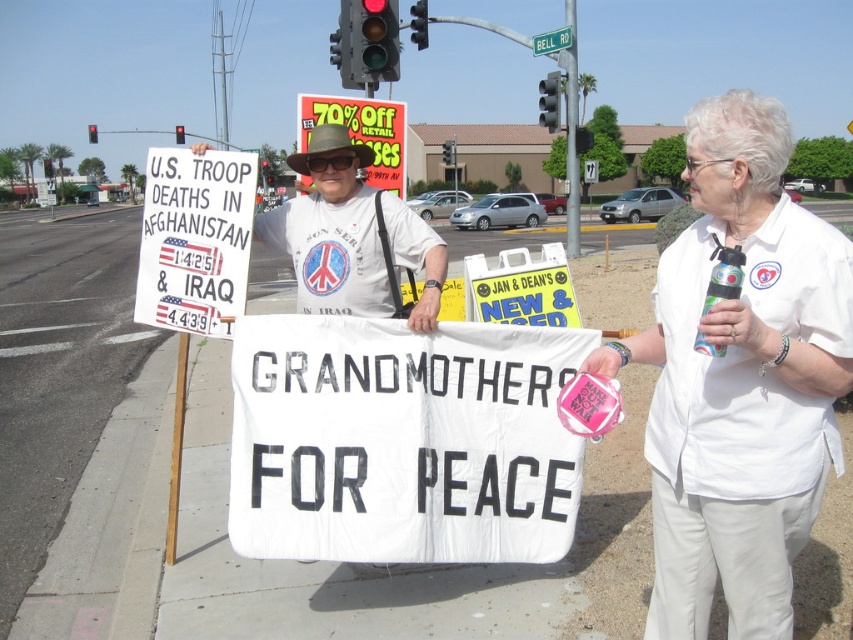
Question: Which object is farther from the camera taking this photo?

Choices:
 (A) white t-shirt with peace symbol at center
 (B) white fabric banner at center
 (C) white plastic street sign at upper center

Answer: (C)

Question: Which object appears farthest from the camera in this image?

Choices:
 (A) white fabric shirt at center
 (B) white fabric banner at center
 (C) white t-shirt with peace symbol at center
 (D) white plastic street sign at upper center

Answer: (D)

Question: Is white fabric shirt at center further to the viewer compared to white plastic street sign at upper center?

Choices:
 (A) no
 (B) yes

Answer: (A)

Question: Does white fabric banner at center have a greater width compared to white plastic street sign at upper center?

Choices:
 (A) no
 (B) yes

Answer: (A)

Question: Which point is farther to the camera?

Choices:
 (A) (654, 412)
 (B) (572, 44)
 (C) (347, 266)

Answer: (B)

Question: Where is white fabric shirt at center located in relation to white plastic street sign at upper center in the image?

Choices:
 (A) right
 (B) left

Answer: (B)